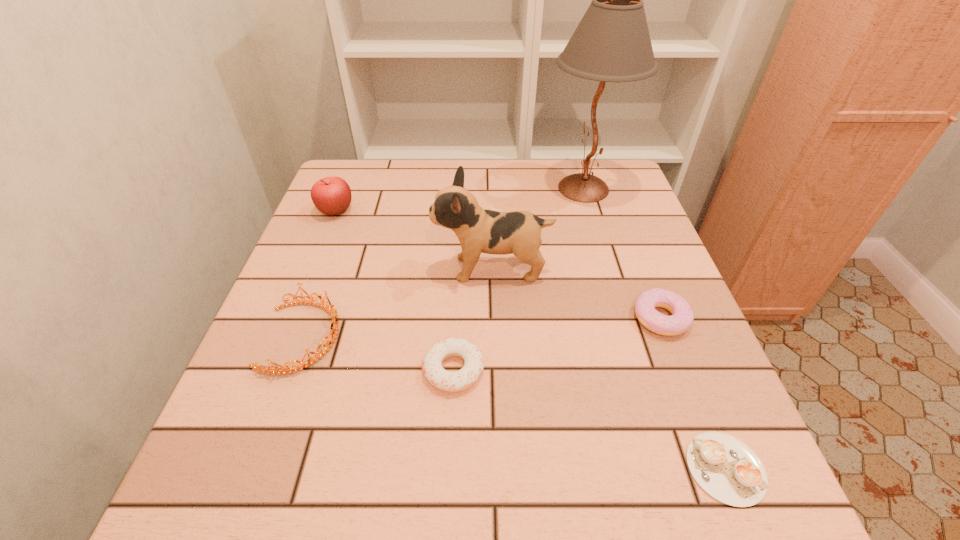
The width and height of the screenshot is (960, 540). What are the coordinates of `table lamp that is at the far edge` in the screenshot? It's located at [612, 43].

Image resolution: width=960 pixels, height=540 pixels. Find the location of `apple that is at the far edge`. apple that is at the far edge is located at coordinates (332, 196).

Find the location of `object present at the near edge`. object present at the near edge is located at coordinates (727, 469).

Where is `apple at the left edge`? This screenshot has height=540, width=960. apple at the left edge is located at coordinates (x=332, y=196).

The height and width of the screenshot is (540, 960). Find the location of `tiara positioned at the left edge`. tiara positioned at the left edge is located at coordinates (332, 311).

The width and height of the screenshot is (960, 540). Identify the location of table lamp present at the right edge. (612, 43).

I want to click on doughnut that is at the right edge, so click(x=682, y=317).

I want to click on cappuccino present at the right edge, so click(x=727, y=469).

Locate an element on the screen. object that is positioned at the far left corner is located at coordinates (332, 196).

Image resolution: width=960 pixels, height=540 pixels. Identify the location of object that is at the far right corner. (612, 43).